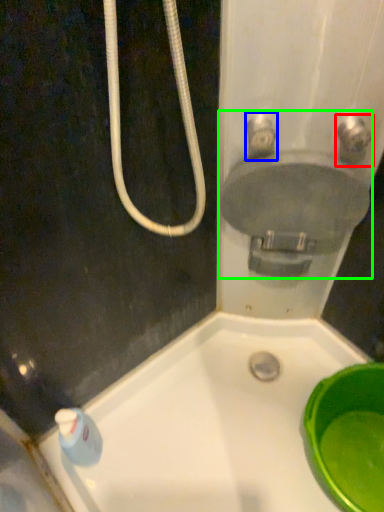
Question: Which object is the farthest from plumbing fixture (highlighted by a red box)? Choose among these: plumbing fixture (highlighted by a blue box) or sink (highlighted by a green box).

Choices:
 (A) plumbing fixture
 (B) sink

Answer: (A)